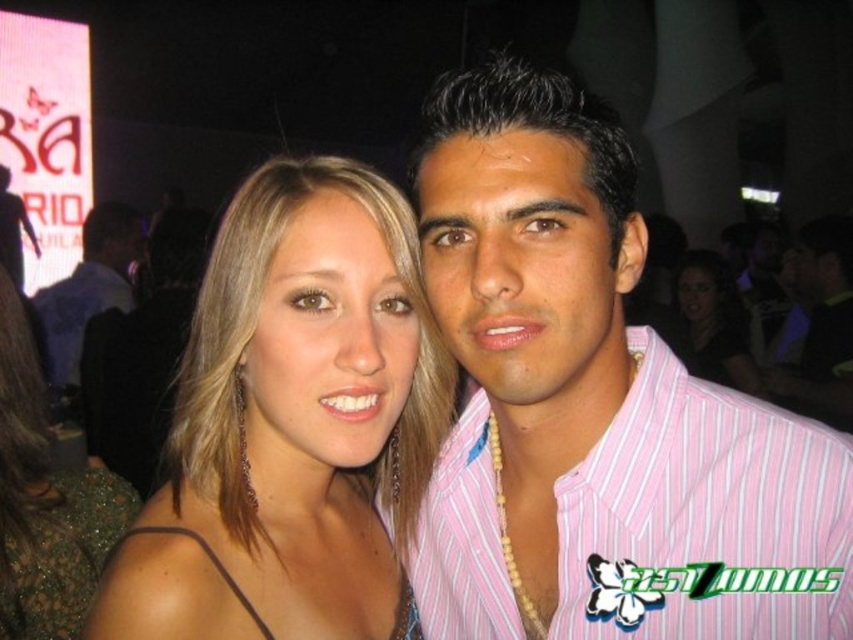
You are standing at the center of the room and see two points in the image. The first point is labeled as point [79,292] and the second is point [711,291]. Which point is closer to you?

Point [79,292] is closer to you because it is in front of point [711,291].

You are at a party and want to take a photo of the two points mentioned. Which point, point (x=785, y=595) or point (x=109, y=529), will appear larger in your photo?

Point (x=785, y=595) is closer to the viewer, so it will appear larger in the photo than point (x=109, y=529).

You are standing in the middle of a crowded room at a party. You see a point at coordinates (596, 410). What object is located at that point?

The point at coordinates (596, 410) indicates the pink striped shirt at center.